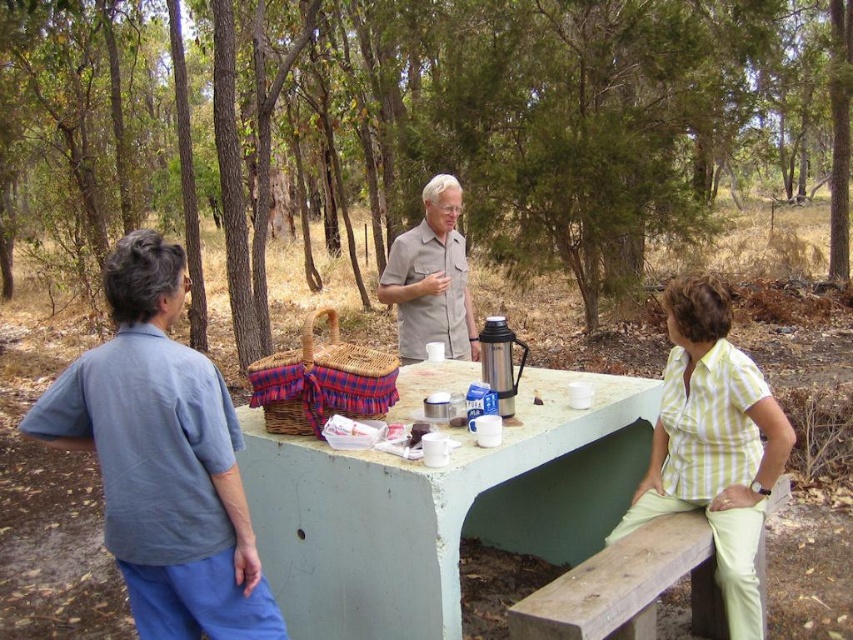
Question: In this image, where is blue cotton shirt at left located relative to yellow striped shirt at lower right?

Choices:
 (A) above
 (B) below

Answer: (A)

Question: Is light brown cotton shirt at center bigger than plaid fabric picnic basket at center?

Choices:
 (A) no
 (B) yes

Answer: (B)

Question: Which of the following is the closest to the observer?

Choices:
 (A) yellow striped shirt at lower right
 (B) light brown cotton shirt at center
 (C) blue cotton shirt at upper left

Answer: (C)

Question: Is the position of green leafy tree at center more distant than that of light brown cotton shirt at center?

Choices:
 (A) no
 (B) yes

Answer: (B)

Question: Among these points, which one is farthest from the camera?

Choices:
 (A) (734, 464)
 (B) (743, 474)

Answer: (B)

Question: Which point appears closest to the camera in this image?

Choices:
 (A) (718, 326)
 (B) (180, 632)
 (C) (445, 184)
 (D) (212, 74)

Answer: (B)